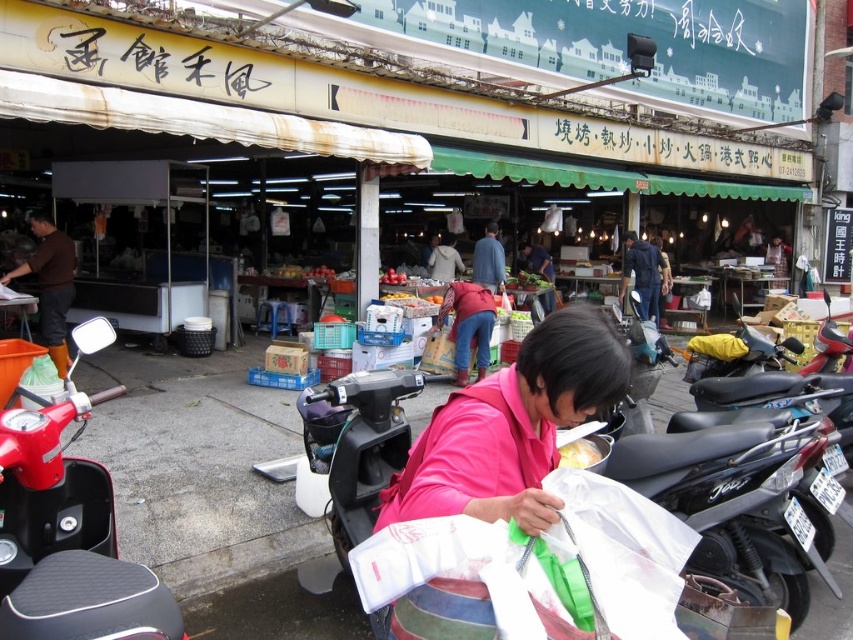
Is point (780, 404) positioned behind point (59, 316)?

No, (780, 404) is in front of (59, 316).

Does black matte scooter at right come behind brown leather boots at left?

No, it is in front of brown leather boots at left.

Image resolution: width=853 pixels, height=640 pixels. Find the location of `black matte scooter at right`. black matte scooter at right is located at coordinates (780, 396).

What do you see at coordinates (511, 426) in the screenshot? I see `pink matte shirt at center` at bounding box center [511, 426].

Does pink matte shirt at center have a greater height compared to brown leather boots at left?

No.

Is point (558, 310) farther from camera compared to point (62, 324)?

Yes, it is.

Find the location of `pink matte shirt at center`. pink matte shirt at center is located at coordinates (511, 426).

Is point (781, 401) more distant than point (463, 296)?

No.

Does black matte scooter at right appear on the right side of denim pants at center?

Correct, you'll find black matte scooter at right to the right of denim pants at center.

The image size is (853, 640). Describe the element at coordinates (780, 396) in the screenshot. I see `black matte scooter at right` at that location.

What are the coordinates of `black matte scooter at right` in the screenshot? It's located at (780, 396).